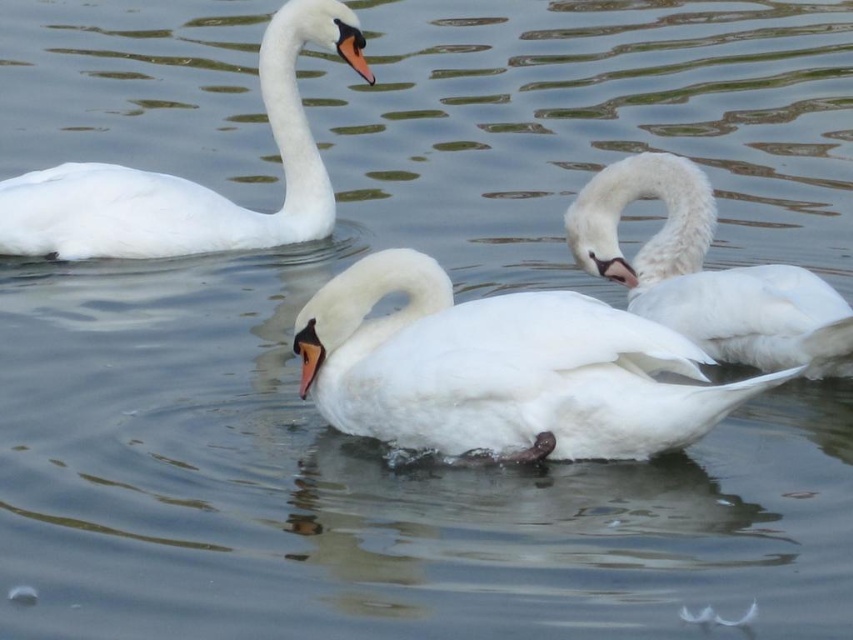
Is white glossy swan at upper left above white fluffy swan at center?

Yes, white glossy swan at upper left is above white fluffy swan at center.

Is white glossy swan at upper left thinner than white fluffy swan at center?

In fact, white glossy swan at upper left might be wider than white fluffy swan at center.

Which is in front, point (311, 36) or point (602, 269)?

Positioned in front is point (602, 269).

You are a GUI agent. You are given a task and a screenshot of the screen. Output one action in this format:
    pyautogui.click(x=<x>, y=<y>)
    Task: Click on the white glossy swan at upper left
    The height and width of the screenshot is (640, 853).
    Given the screenshot: What is the action you would take?
    pyautogui.click(x=189, y=179)

Image resolution: width=853 pixels, height=640 pixels. Describe the element at coordinates (502, 369) in the screenshot. I see `white matte swan at center` at that location.

This screenshot has height=640, width=853. Describe the element at coordinates (502, 369) in the screenshot. I see `white matte swan at center` at that location.

The width and height of the screenshot is (853, 640). In order to click on white matte swan at center in this screenshot , I will do `click(502, 369)`.

Is point (392, 362) closer to camera compared to point (762, 291)?

Yes, point (392, 362) is closer to viewer.

Is the position of white matte swan at center more distant than that of white fluffy swan at center?

No.

I want to click on white matte swan at center, so click(x=502, y=369).

I want to click on white matte swan at center, so click(x=502, y=369).